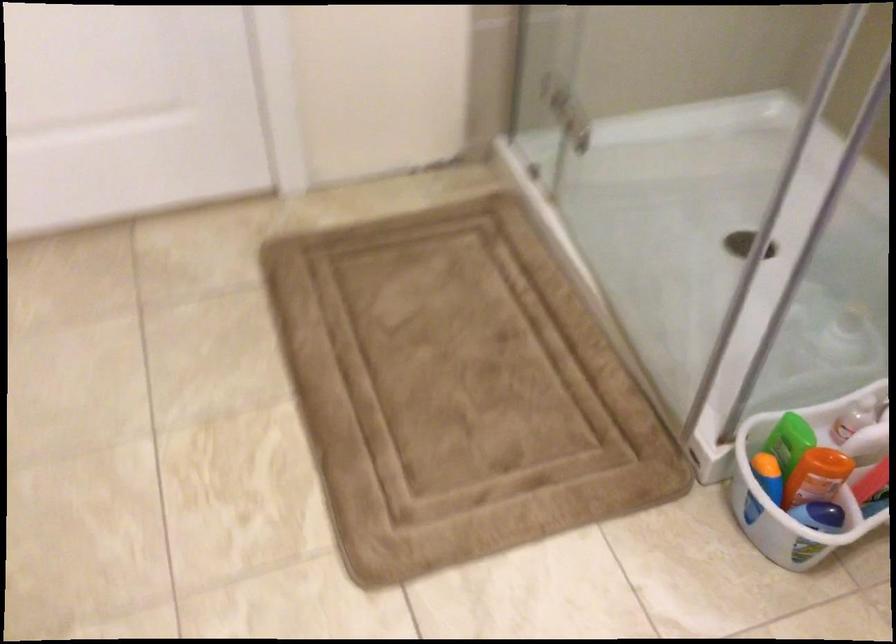
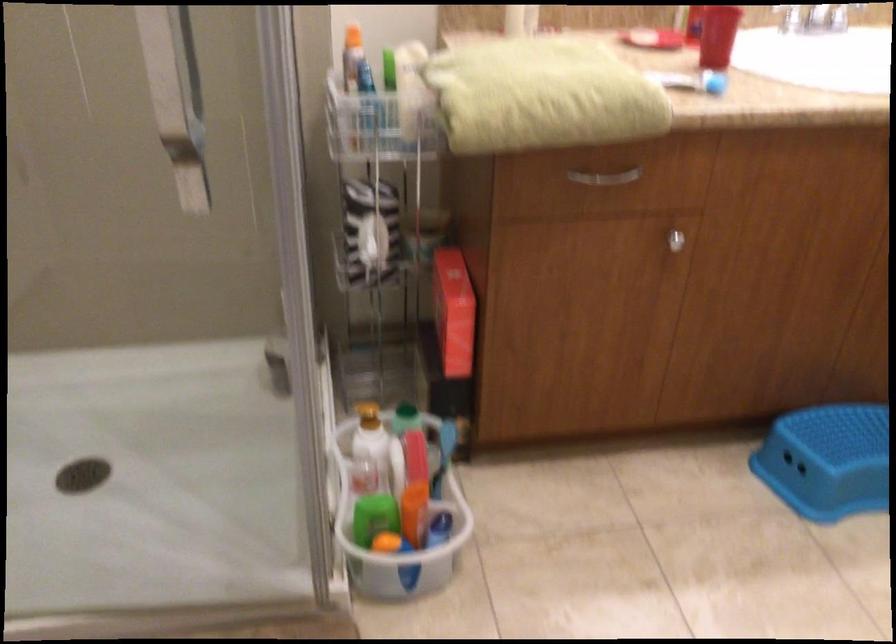
How did the camera likely rotate?

The camera rotated toward right-down.